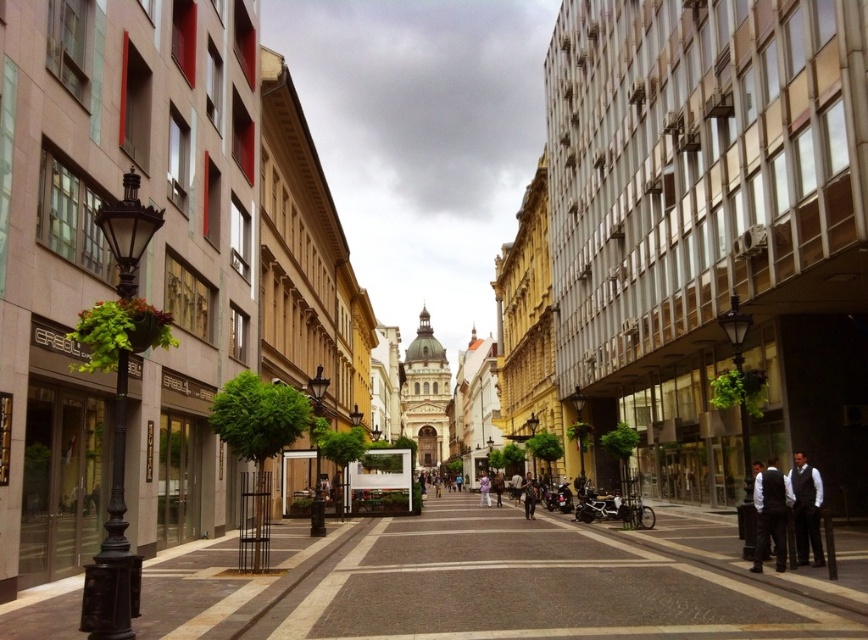
Question: Considering the real-world distances, which object is farthest from the dark gray suit at right?

Choices:
 (A) white fabric person at center
 (B) dark gray suit at lower right

Answer: (A)

Question: Where is dark gray suit at lower right located in relation to dark gray suit at right in the image?

Choices:
 (A) below
 (B) above

Answer: (A)

Question: Which of the following is the closest to the observer?

Choices:
 (A) (784, 493)
 (B) (813, 512)
 (C) (479, 483)

Answer: (B)

Question: Does dark gray suit at lower right appear on the left side of dark gray suit at right?

Choices:
 (A) yes
 (B) no

Answer: (A)

Question: Does dark gray suit at right lie in front of white fabric person at center?

Choices:
 (A) yes
 (B) no

Answer: (A)

Question: Which point appears closest to the camera in this image?

Choices:
 (A) (755, 563)
 (B) (479, 502)
 (C) (807, 464)

Answer: (A)